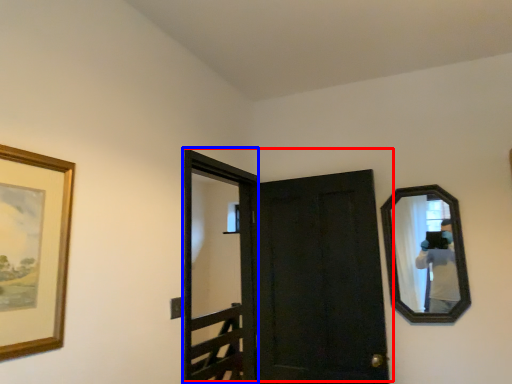
Question: Which object appears farthest to the camera in this image, door (highlighted by a red box) or screen door (highlighted by a blue box)?

Choices:
 (A) door
 (B) screen door

Answer: (A)